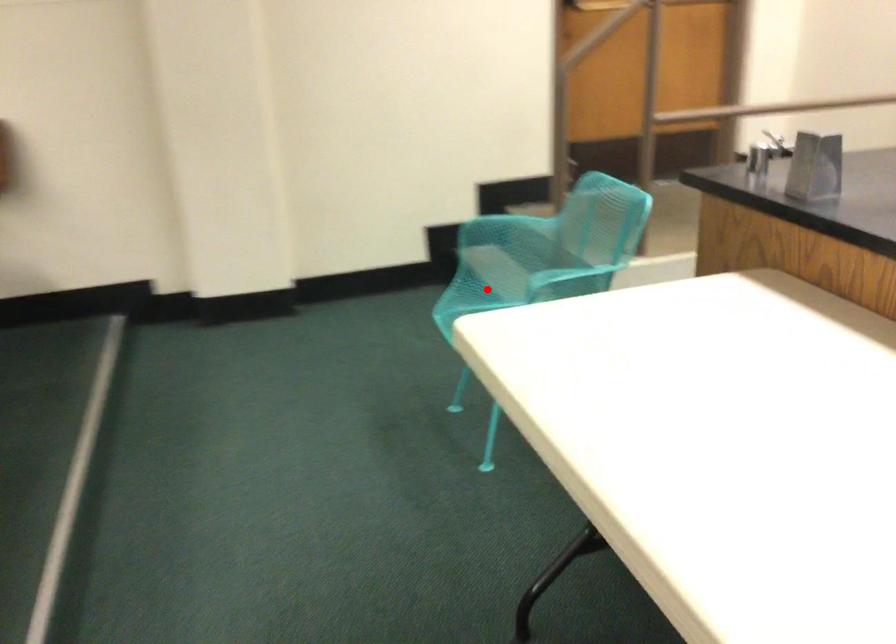
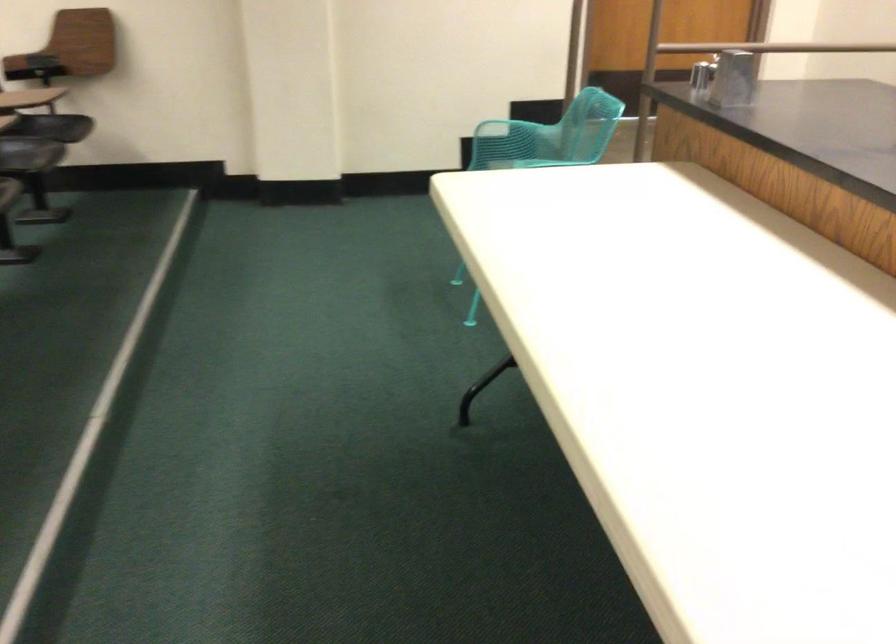
Question: I am providing you with two images of the same scene from different viewpoints. A red point is marked on the first image. Is the red point's position out of view in image 2?

Choices:
 (A) Yes
 (B) No

Answer: (A)